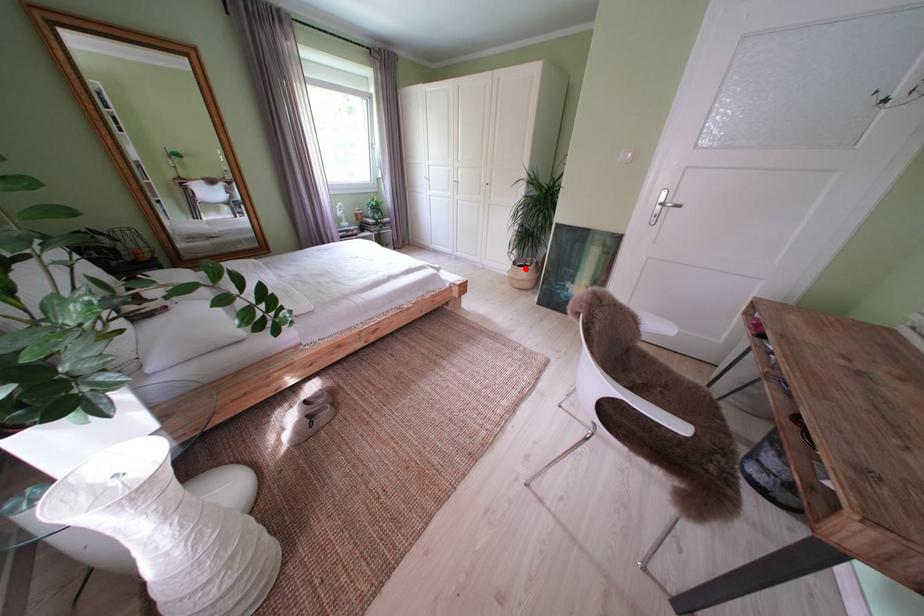
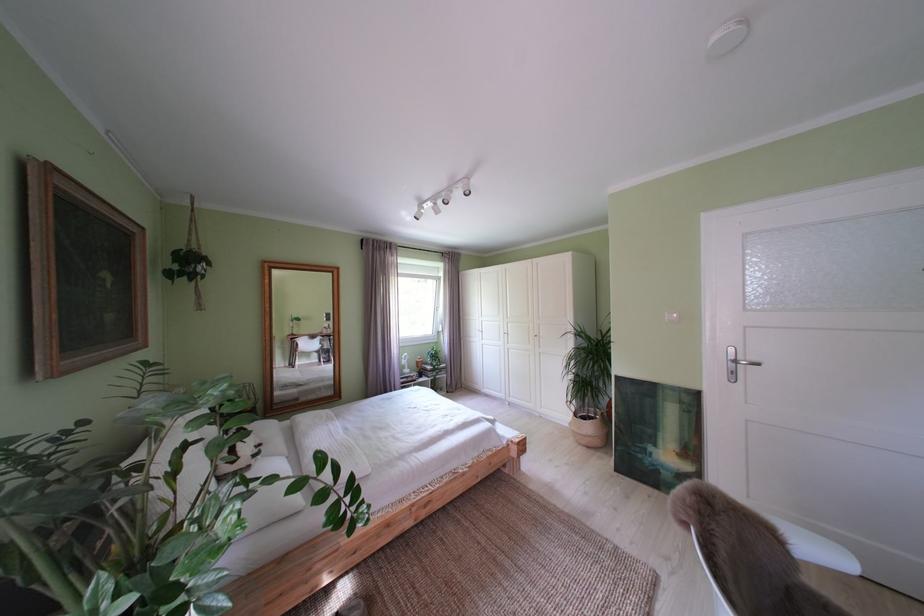
In the second image, find the point that corresponds to the highlighted location in the first image.

(587, 419)